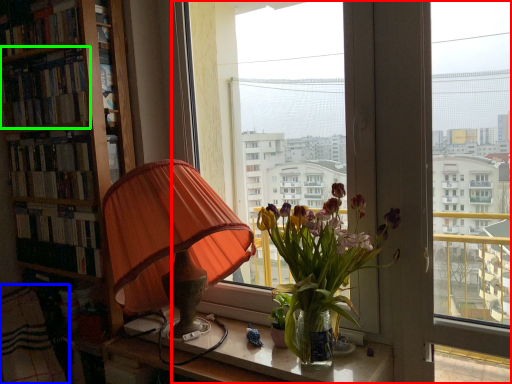
Question: Which object is positioned farthest from window (highlighted by a red box)? Select from blanket (highlighted by a blue box) and book (highlighted by a green box).

Choices:
 (A) blanket
 (B) book

Answer: (A)